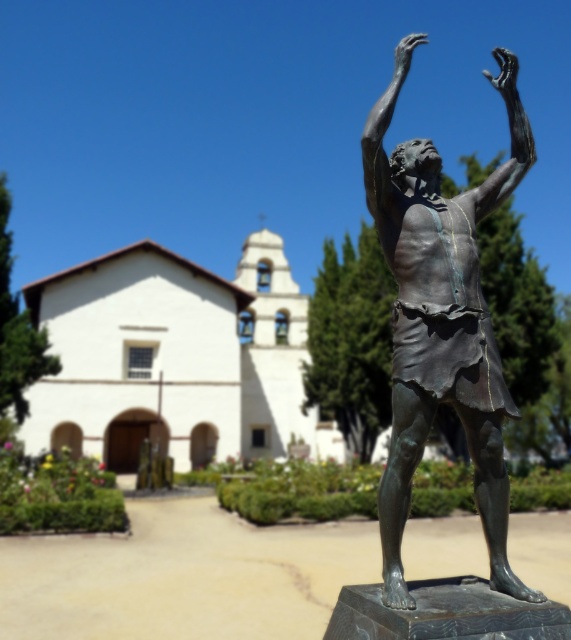
You are an architect visiting the site and need to place a new sculpture exactly halfway between the white stucco church at center and the bronze statue at center. Given their sizes, which object will the new sculpture be closer to?

The new sculpture will be closer to the bronze statue at center because the white stucco church at center is larger in size, so the halfway point would be nearer to the smaller object.

You are standing in front of the bronze statue of a man standing with his arms raised. If you want to walk directly towards the white stucco church at center, in which direction should you move relative to your current position?

You should move towards the point at coordinates (175, 358) to reach the white stucco church at center.

From the picture: You are standing in a plaza and see the white stucco church at center and the bronze statue at center. Which one is positioned to the left from your perspective?

The white stucco church at center is positioned to the left of the bronze statue at center.